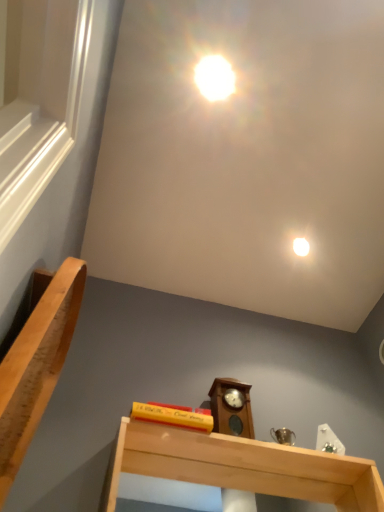
Question: Is white glossy droplight at upper center with wooden grandfather clock at center?

Choices:
 (A) yes
 (B) no

Answer: (B)

Question: Is white glossy droplight at upper center bigger than wooden grandfather clock at center?

Choices:
 (A) no
 (B) yes

Answer: (A)

Question: From a real-world perspective, does white glossy droplight at upper center sit lower than wooden grandfather clock at center?

Choices:
 (A) no
 (B) yes

Answer: (A)

Question: Does white glossy droplight at upper center come in front of wooden grandfather clock at center?

Choices:
 (A) no
 (B) yes

Answer: (A)

Question: Is white glossy droplight at upper center positioned behind wooden grandfather clock at center?

Choices:
 (A) yes
 (B) no

Answer: (A)

Question: Considering the relative sizes of white glossy droplight at upper center and wooden grandfather clock at center in the image provided, is white glossy droplight at upper center thinner than wooden grandfather clock at center?

Choices:
 (A) no
 (B) yes

Answer: (B)

Question: Is light wood shelf at lower center at the left side of wooden grandfather clock at center?

Choices:
 (A) no
 (B) yes

Answer: (A)

Question: Is light wood shelf at lower center wider than wooden grandfather clock at center?

Choices:
 (A) no
 (B) yes

Answer: (B)

Question: From the image's perspective, is light wood shelf at lower center located above wooden grandfather clock at center?

Choices:
 (A) no
 (B) yes

Answer: (A)

Question: From the image's perspective, would you say light wood shelf at lower center is shown under wooden grandfather clock at center?

Choices:
 (A) no
 (B) yes

Answer: (B)

Question: From a real-world perspective, is light wood shelf at lower center physically below wooden grandfather clock at center?

Choices:
 (A) no
 (B) yes

Answer: (B)

Question: Can you confirm if light wood shelf at lower center is thinner than wooden grandfather clock at center?

Choices:
 (A) yes
 (B) no

Answer: (B)

Question: Does light wood shelf at lower center have a greater height compared to white glossy droplight at upper center?

Choices:
 (A) no
 (B) yes

Answer: (B)